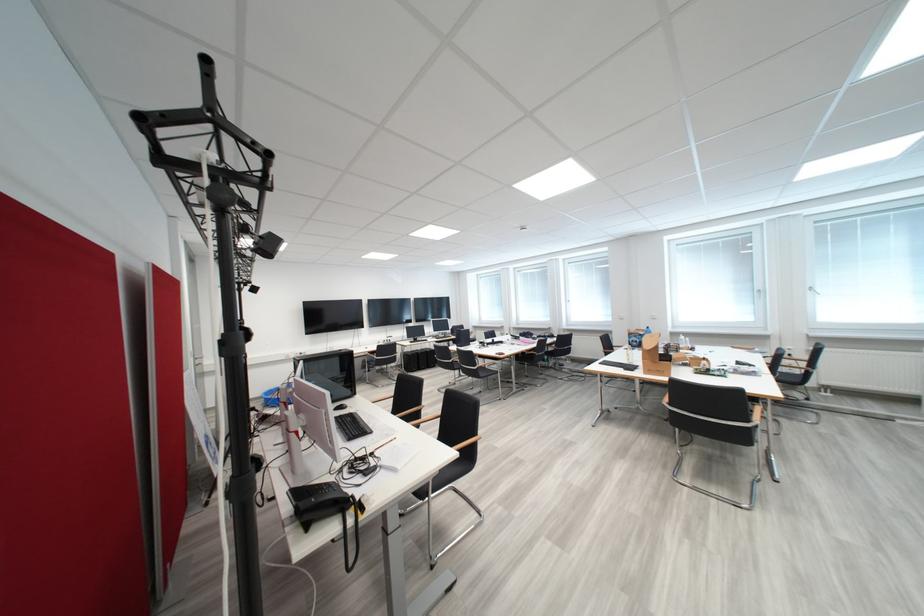
Where is `telephone handset`? This screenshot has width=924, height=616. telephone handset is located at coordinates (322, 505).